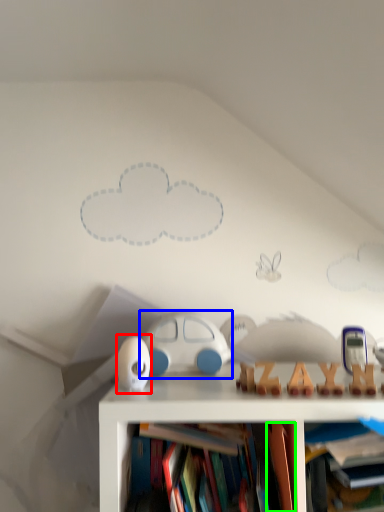
Question: Based on their relative distances, which object is farther from toy (highlighted by a red box)? Choose from toy (highlighted by a blue box) and book (highlighted by a green box).

Choices:
 (A) toy
 (B) book

Answer: (B)